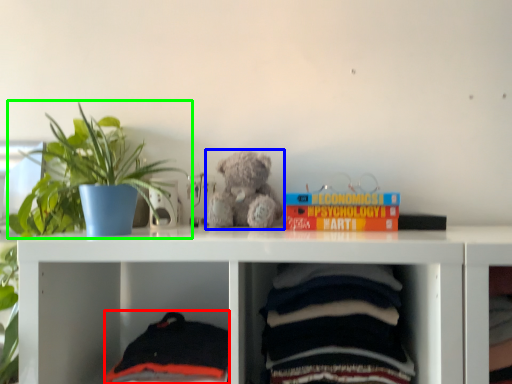
Question: Considering the real-world distances, which object is farthest from baby clothe (highlighted by a red box)? teddy bear (highlighted by a blue box) or houseplant (highlighted by a green box)?

Choices:
 (A) teddy bear
 (B) houseplant

Answer: (B)